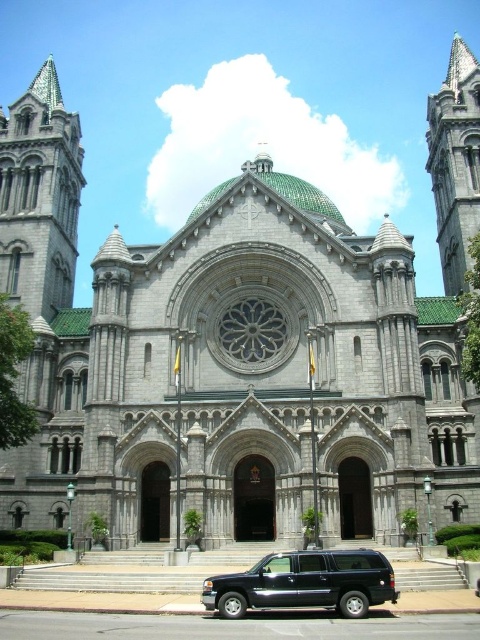
Question: Is gray stone tower at upper right above black matte suv at lower center?

Choices:
 (A) yes
 (B) no

Answer: (A)

Question: Observing the image, what is the correct spatial positioning of gray stone tower at upper right in reference to black matte suv at lower center?

Choices:
 (A) below
 (B) above

Answer: (B)

Question: Is gray stone tower at upper right below black matte suv at lower center?

Choices:
 (A) yes
 (B) no

Answer: (B)

Question: Which point is farther to the camera?

Choices:
 (A) (430, 147)
 (B) (359, 586)

Answer: (A)

Question: Which point is closer to the camera?

Choices:
 (A) black matte suv at lower center
 (B) gray stone tower at upper right

Answer: (A)